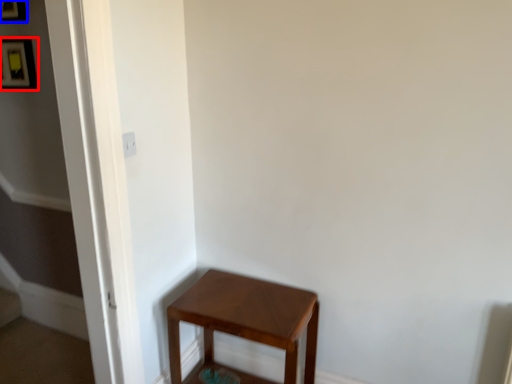
Question: Which object appears farthest to the camera in this image, picture frame (highlighted by a red box) or picture frame (highlighted by a blue box)?

Choices:
 (A) picture frame
 (B) picture frame

Answer: (A)